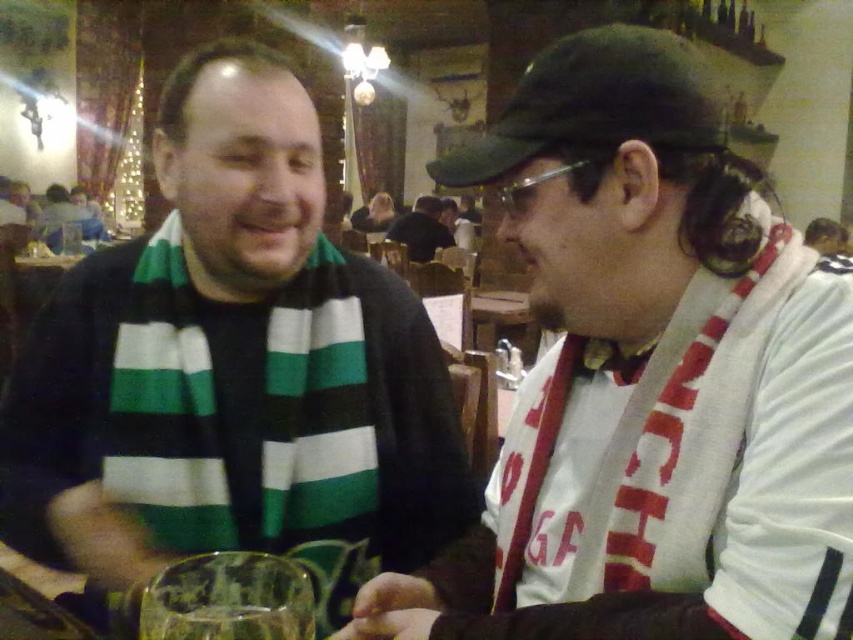
Question: Which object appears farthest from the camera in this image?

Choices:
 (A) translucent glass at lower center
 (B) transparent glass at lower center

Answer: (A)

Question: Considering the relative positions of green matte baseball cap at upper center and green striped scarf at upper left in the image provided, where is green matte baseball cap at upper center located with respect to green striped scarf at upper left?

Choices:
 (A) right
 (B) left

Answer: (A)

Question: Is green matte baseball cap at upper center smaller than white scarf at center?

Choices:
 (A) yes
 (B) no

Answer: (A)

Question: Is transparent glass at lower center closer to camera compared to green striped scarf at upper left?

Choices:
 (A) no
 (B) yes

Answer: (B)

Question: Which point is closer to the camera taking this photo?

Choices:
 (A) (106, 548)
 (B) (635, 195)
 (C) (228, 582)
 (D) (86, 237)

Answer: (C)

Question: Which point appears farthest from the camera in this image?

Choices:
 (A) (281, 616)
 (B) (685, 67)
 (C) (283, 632)
 (D) (421, 253)

Answer: (D)